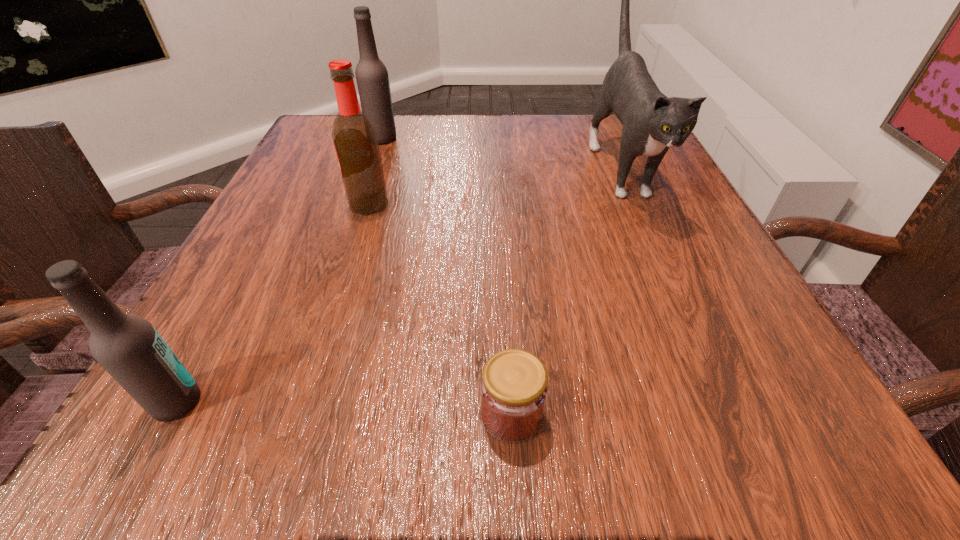
At what (x,y) coordinates should I click in order to perform the action: click on free point between the leftmost object and the rightmost object. Please return your answer as a coordinate pair (x, y). The height and width of the screenshot is (540, 960). Looking at the image, I should click on (398, 283).

Locate an element on the screen. Image resolution: width=960 pixels, height=540 pixels. vacant region between the second farthest beer bottle and the second object from right to left is located at coordinates (440, 309).

Locate an element on the screen. free space that is in between the fourth object from left to right and the cat is located at coordinates (565, 289).

Find the location of `empty space that is in between the farthest beer bottle and the shortest object`. empty space that is in between the farthest beer bottle and the shortest object is located at coordinates (446, 276).

Identify which object is located as the fourth nearest to the second nearest beer bottle. Please provide its 2D coordinates. Your answer should be formatted as a tuple, i.e. [(x, y)], where the tuple contains the x and y coordinates of a point satisfying the conditions above.

[(652, 123)]

Image resolution: width=960 pixels, height=540 pixels. I want to click on object that stands as the third closest to the farthest beer bottle, so click(128, 347).

Identify the location of beer bottle identified as the closest to the cat. (355, 140).

Identify which beer bottle is located as the second nearest to the second nearest beer bottle. Please provide its 2D coordinates. Your answer should be formatted as a tuple, i.e. [(x, y)], where the tuple contains the x and y coordinates of a point satisfying the conditions above.

[(128, 347)]

Where is `vacant space that satisfies the following two spatial constraints: 1. on the back side of the second nearest beer bottle; 2. on the side of the farthest beer bottle with the label`? The height and width of the screenshot is (540, 960). vacant space that satisfies the following two spatial constraints: 1. on the back side of the second nearest beer bottle; 2. on the side of the farthest beer bottle with the label is located at coordinates (390, 138).

The image size is (960, 540). What are the coordinates of `free space that satisfies the following two spatial constraints: 1. on the label of the second object from right to left; 2. on the left side of the leftmost object` in the screenshot? It's located at (170, 414).